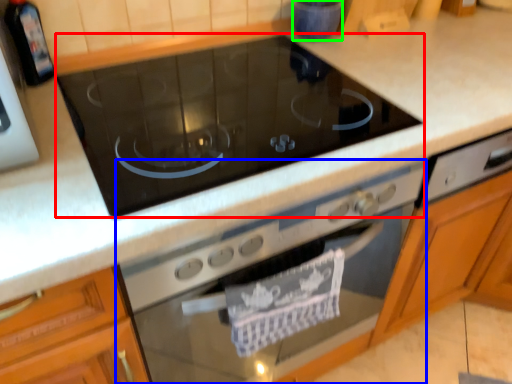
Question: Considering the real-world distances, which object is farthest from gas stove (highlighted by a red box)? home appliance (highlighted by a blue box) or appliance (highlighted by a green box)?

Choices:
 (A) home appliance
 (B) appliance

Answer: (B)